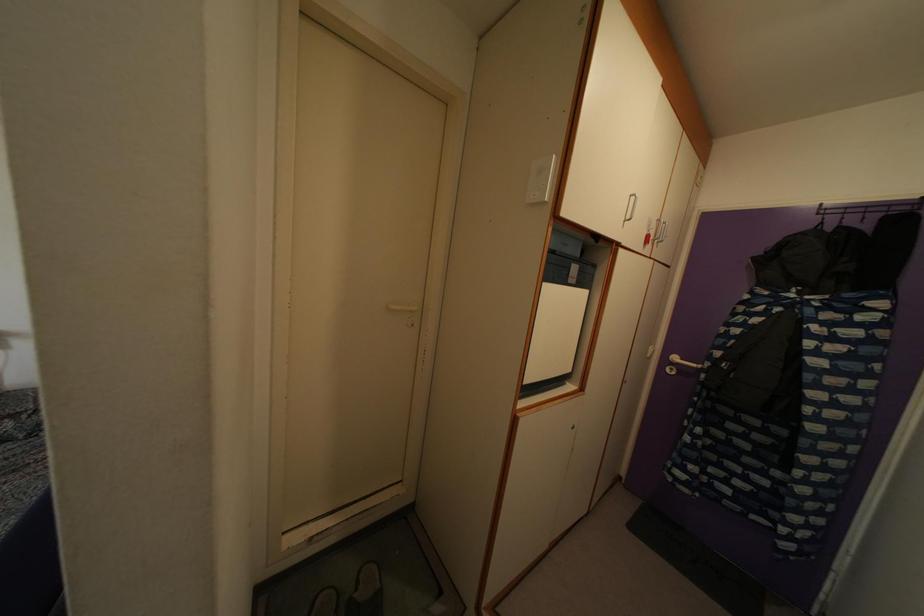
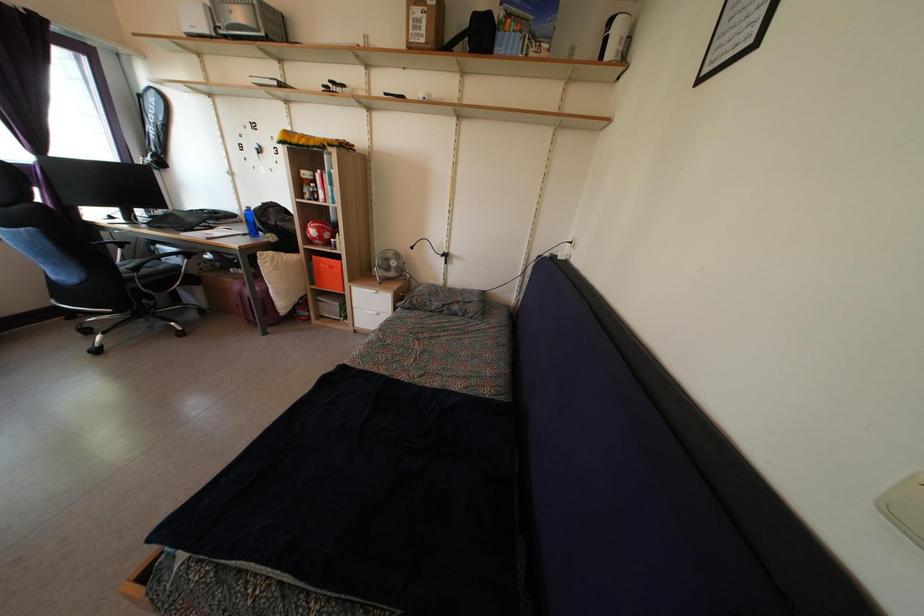
Question: How did the camera likely rotate?

Choices:
 (A) Left
 (B) Right
 (C) Up
 (D) Down

Answer: (A)